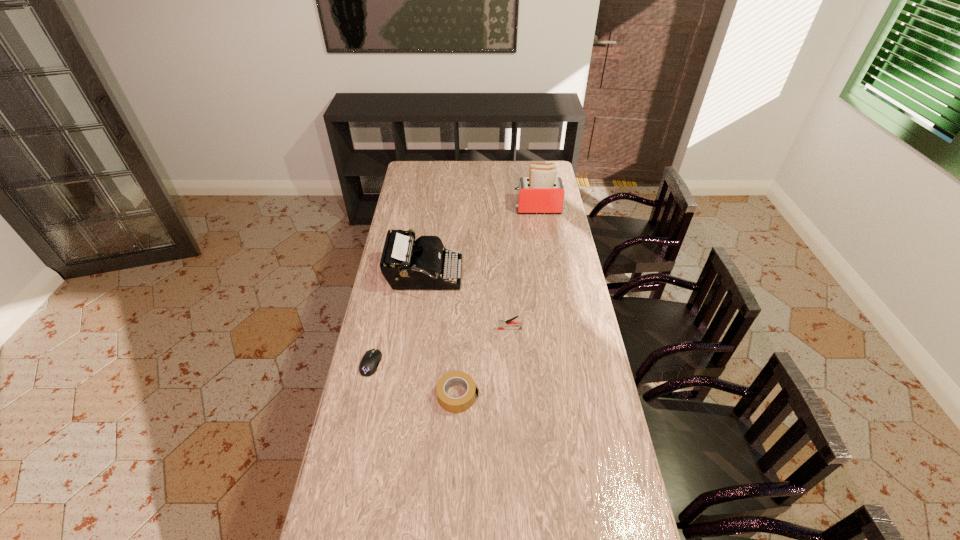
Where is `computer equipment present at the left edge`? This screenshot has height=540, width=960. computer equipment present at the left edge is located at coordinates (371, 359).

Locate an element on the screen. object positioned at the right edge is located at coordinates (542, 192).

Identify the location of vacant space at the far edge of the desktop. The image size is (960, 540). (485, 172).

The width and height of the screenshot is (960, 540). I want to click on vacant space at the left edge, so click(407, 185).

Find the location of a particular element. This screenshot has height=540, width=960. free space at the right edge is located at coordinates [x=580, y=375].

You are a GUI agent. You are given a task and a screenshot of the screen. Output one action in this format:
    pyautogui.click(x=<x>, y=<y>)
    Task: Click on the vacant space at the far left corner of the desktop
    The width and height of the screenshot is (960, 540).
    Given the screenshot: What is the action you would take?
    pyautogui.click(x=418, y=181)

Where is `free space between the toaster and the typewriter`? The height and width of the screenshot is (540, 960). free space between the toaster and the typewriter is located at coordinates (481, 242).

Image resolution: width=960 pixels, height=540 pixels. I want to click on free space that is in between the tallest object and the fourth object from left to right, so click(x=523, y=268).

Identify the location of unoccupied area between the second tallest object and the fourth tallest object. (442, 335).

Where is `vacant area that lies between the stapler and the fourth farthest object`? vacant area that lies between the stapler and the fourth farthest object is located at coordinates (441, 346).